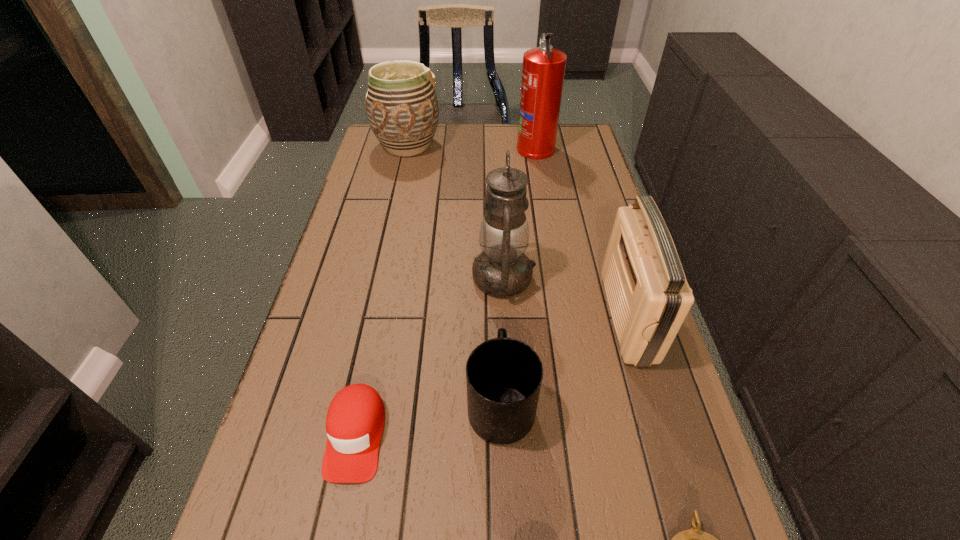
Locate an element on the screen. pottery located in the left edge section of the desktop is located at coordinates (402, 109).

Where is `baseball cap present at the left edge`? baseball cap present at the left edge is located at coordinates (355, 419).

You are a GUI agent. You are given a task and a screenshot of the screen. Output one action in this format:
    pyautogui.click(x=<x>, y=<y>)
    Task: Click on the fire extinguisher located in the right edge section of the desktop
    
    Given the screenshot: What is the action you would take?
    pyautogui.click(x=543, y=70)

Locate an element on the screen. The image size is (960, 540). radio receiver that is at the right edge is located at coordinates (648, 295).

At what (x,y) coordinates should I click in order to perform the action: click on object at the far left corner. Please return your answer as a coordinate pair (x, y). Looking at the image, I should click on (402, 109).

The width and height of the screenshot is (960, 540). What are the coordinates of `object that is positioned at the far right corner` in the screenshot? It's located at (543, 70).

The width and height of the screenshot is (960, 540). In the image, there is a desktop. Find the location of `vacant space at the far edge`. vacant space at the far edge is located at coordinates (500, 131).

This screenshot has height=540, width=960. In order to click on vacant point at the left edge in this screenshot , I will do `click(350, 255)`.

In the image, there is a desktop. Where is `free space at the right edge`? This screenshot has height=540, width=960. free space at the right edge is located at coordinates (581, 303).

Locate an element on the screen. Image resolution: width=960 pixels, height=540 pixels. vacant space in between the radio receiver and the oil lamp is located at coordinates (565, 297).